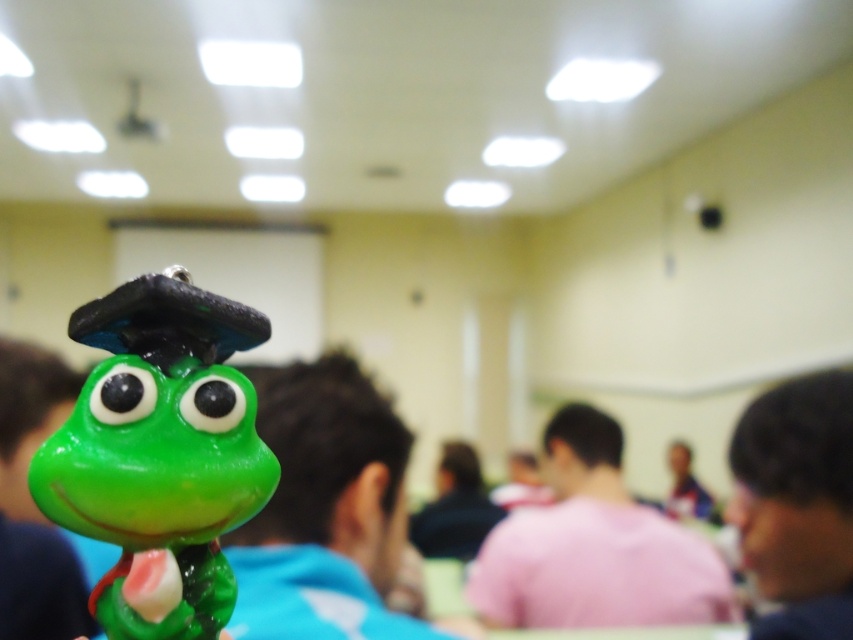
You are a photographer standing in the background of the image. You want to take a photo of the pink matte shirt at center and the dark brown hair at lower right together in the frame. Given that your camera has a minimum focus distance of 30 inches, will you be able to capture both subjects clearly?

The pink matte shirt at center and dark brown hair at lower right are 32.48 inches apart from each other. Since the distance between them is greater than the camera minimum focus distance of 30 inches, you can capture both subjects clearly in the frame.

You are standing in the classroom and see the green frog figurine at center. Where is the point located at coordinates (160, 452)?

The point at coordinates (160, 452) is on the green matte plastic frog at center.